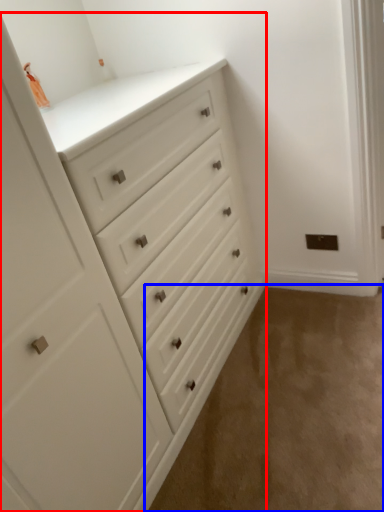
Question: Which object appears farthest to the camera in this image, chest of drawers (highlighted by a red box) or corridor (highlighted by a blue box)?

Choices:
 (A) chest of drawers
 (B) corridor

Answer: (B)